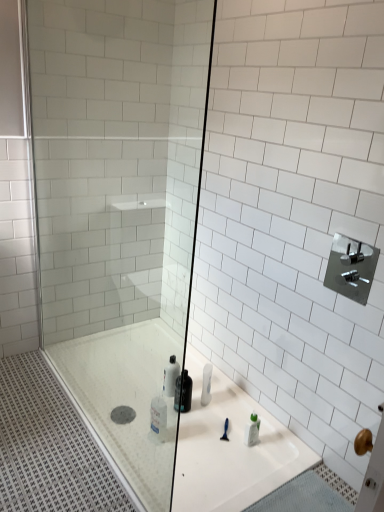
Image resolution: width=384 pixels, height=512 pixels. Describe the element at coordinates (120, 211) in the screenshot. I see `transparent glass shower door at center` at that location.

Describe the element at coordinates (351, 268) in the screenshot. I see `satin nickel faucet at upper right` at that location.

You are a GUI agent. You are given a task and a screenshot of the screen. Output one action in this format:
    pyautogui.click(x=<x>, y=<y>)
    Task: Click on the satin nickel faucet at upper right
    
    Given the screenshot: What is the action you would take?
    pyautogui.click(x=351, y=268)

I want to click on transparent glass shower door at center, so click(x=120, y=211).

From the image's perspective, is transparent glass shower door at center positioned above or below satin nickel faucet at upper right?

Clearly, from the image's perspective, transparent glass shower door at center is above satin nickel faucet at upper right.

Which object is further away from the camera, transparent glass shower door at center or satin nickel faucet at upper right?

satin nickel faucet at upper right.

The height and width of the screenshot is (512, 384). What are the coordinates of `shower door on the left of satin nickel faucet at upper right` in the screenshot? It's located at (120, 211).

Can you confirm if transparent glass shower door at center is wider than satin nickel faucet at upper right?

Yes, transparent glass shower door at center is wider than satin nickel faucet at upper right.

From a real-world perspective, is translucent plastic bottle at center above or below satin nickel faucet at upper right?

In terms of real-world spatial position, translucent plastic bottle at center is below satin nickel faucet at upper right.

Is translucent plastic bottle at center next to satin nickel faucet at upper right and touching it?

No, translucent plastic bottle at center is not next to satin nickel faucet at upper right.

Is translucent plastic bottle at center inside or outside of satin nickel faucet at upper right?

translucent plastic bottle at center is not inside satin nickel faucet at upper right, it's outside.

Locate an element on the screen. The width and height of the screenshot is (384, 512). shower door on the left of the translucent plastic bottle at center is located at coordinates (120, 211).

Is transparent glass shower door at center oriented towards translucent plastic bottle at center?

No, transparent glass shower door at center is not aimed at translucent plastic bottle at center.

From a real-world perspective, is transparent glass shower door at center on top of translucent plastic bottle at center?

Yes, from a real-world perspective, transparent glass shower door at center is on top of translucent plastic bottle at center.

What's the angular difference between transparent glass shower door at center and translucent plastic bottle at center's facing directions?

87.1 degrees.

I want to click on shower that is above the transparent glass shower door at center (from a real-world perspective), so (351, 268).

Does satin nickel faucet at upper right have a lesser height compared to transparent glass shower door at center?

Yes, satin nickel faucet at upper right is shorter than transparent glass shower door at center.

From the image's perspective, who appears lower, satin nickel faucet at upper right or transparent glass shower door at center?

satin nickel faucet at upper right.

From a real-world perspective, which object stands above the other?

transparent glass shower door at center is physically above.

Who is taller, translucent plastic bottle at center or transparent glass shower door at center?

Standing taller between the two is transparent glass shower door at center.

Who is more distant, translucent plastic bottle at center or transparent glass shower door at center?

translucent plastic bottle at center.

Is translucent plastic bottle at center outside of transparent glass shower door at center?

That's correct, translucent plastic bottle at center is outside of transparent glass shower door at center.

In terms of size, does satin nickel faucet at upper right appear bigger or smaller than translucent plastic bottle at center?

satin nickel faucet at upper right is bigger than translucent plastic bottle at center.

Between satin nickel faucet at upper right and translucent plastic bottle at center, which one appears on the right side from the viewer's perspective?

From the viewer's perspective, satin nickel faucet at upper right appears more on the right side.

Considering the relative sizes of satin nickel faucet at upper right and translucent plastic bottle at center in the image provided, is satin nickel faucet at upper right taller than translucent plastic bottle at center?

Correct, satin nickel faucet at upper right is much taller as translucent plastic bottle at center.

At what (x,y) coordinates should I click in order to perform the action: click on shower door above the satin nickel faucet at upper right (from the image's perspective). Please return your answer as a coordinate pair (x, y). This screenshot has width=384, height=512. Looking at the image, I should click on (120, 211).

Locate an element on the screen. This screenshot has width=384, height=512. shower that appears on the right of translucent plastic bottle at center is located at coordinates (351, 268).

Considering their positions, is satin nickel faucet at upper right positioned further to transparent glass shower door at center than translucent plastic bottle at center?

Based on the image, satin nickel faucet at upper right appears to be further to transparent glass shower door at center.

From the image, which object appears to be nearer to satin nickel faucet at upper right, transparent glass shower door at center or translucent plastic bottle at center?

translucent plastic bottle at center.

When comparing their distances from translucent plastic bottle at center, does satin nickel faucet at upper right or transparent glass shower door at center seem further?

Among the two, satin nickel faucet at upper right is located further to translucent plastic bottle at center.

Looking at the image, which one is located closer to transparent glass shower door at center, translucent plastic bottle at center or satin nickel faucet at upper right?

translucent plastic bottle at center is closer to transparent glass shower door at center.

Based on their spatial positions, is translucent plastic bottle at center or transparent glass shower door at center further from satin nickel faucet at upper right?

Based on the image, transparent glass shower door at center appears to be further to satin nickel faucet at upper right.

Based on their spatial positions, is transparent glass shower door at center or satin nickel faucet at upper right closer to translucent plastic bottle at center?

The object closer to translucent plastic bottle at center is transparent glass shower door at center.

Identify the location of shower positioned between transparent glass shower door at center and translucent plastic bottle at center from near to far. (351, 268).